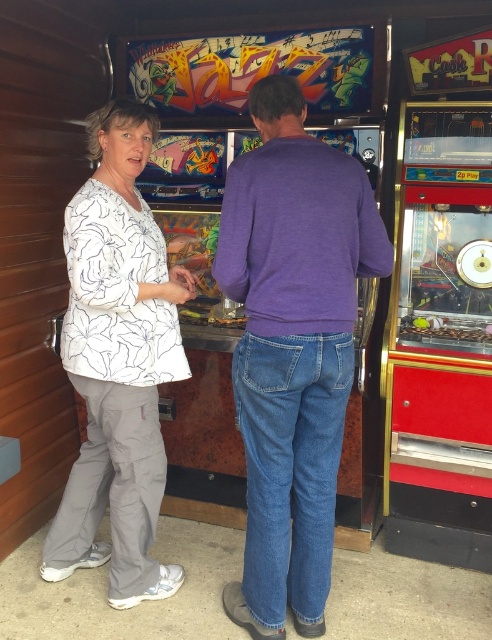
Is purple cotton sweater at center positioned before white printed shirt at left?

Yes, it is in front of white printed shirt at left.

Who is lower down, purple cotton sweater at center or white printed shirt at left?

purple cotton sweater at center is below.

What do you see at coordinates (293, 348) in the screenshot? I see `purple cotton sweater at center` at bounding box center [293, 348].

Where is `purple cotton sweater at center`? Image resolution: width=492 pixels, height=640 pixels. purple cotton sweater at center is located at coordinates (293, 348).